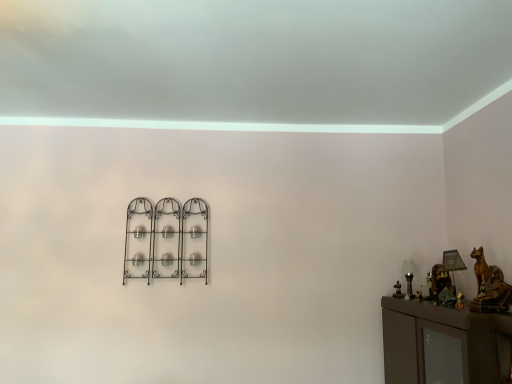
Question: From the image's perspective, is metallic gold table lamp at right, which appears as the second table lamp when viewed from the left, positioned above or below black wrought iron candle holder at center?

Choices:
 (A) above
 (B) below

Answer: (B)

Question: Visually, is metallic gold table lamp at right, marked as the first table lamp in a right-to-left arrangement, positioned to the left or to the right of black wrought iron candle holder at center?

Choices:
 (A) right
 (B) left

Answer: (A)

Question: Estimate the real-world distances between objects in this image. Which object is farther from the metallic gold table lamp at right, which appears as the second table lamp when viewed from the left?

Choices:
 (A) black wrought iron candle holder at center
 (B) white glass table lamp at right, which ranks as the 1th table lamp in back-to-front order

Answer: (A)

Question: Estimate the real-world distances between objects in this image. Which object is closer to the white glass table lamp at right, arranged as the second table lamp when viewed from the right?

Choices:
 (A) black wrought iron candle holder at center
 (B) metallic gold table lamp at right, placed as the second table lamp when sorted from back to front

Answer: (B)